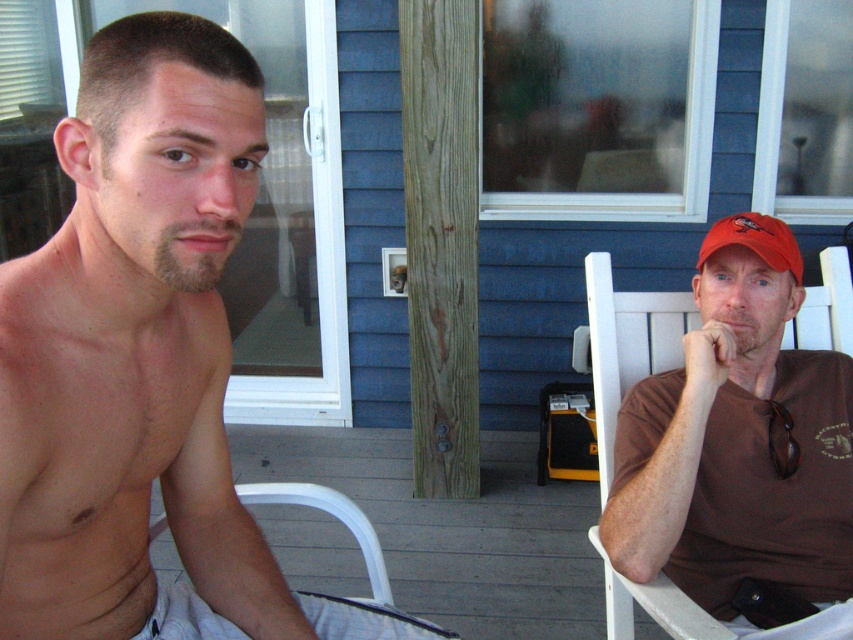
Can you confirm if shiny skin at left is positioned above brown matte shirt at right?

Correct, shiny skin at left is located above brown matte shirt at right.

Between shiny skin at left and brown matte shirt at right, which one has more height?

Standing taller between the two is shiny skin at left.

Which is in front, point (183, 38) or point (607, 504)?

Point (183, 38) is more forward.

Locate an element on the screen. shiny skin at left is located at coordinates (140, 368).

Is point (724, 422) closer to camera compared to point (215, 241)?

No.

Is brown matte shirt at right thinner than beige soft facial hair at center?

No, brown matte shirt at right is not thinner than beige soft facial hair at center.

What do you see at coordinates (738, 442) in the screenshot?
I see `brown matte shirt at right` at bounding box center [738, 442].

Locate an element on the screen. The height and width of the screenshot is (640, 853). brown matte shirt at right is located at coordinates (738, 442).

Can you confirm if brown matte shirt at right is wider than red matte baseball cap at right?

Correct, the width of brown matte shirt at right exceeds that of red matte baseball cap at right.

Which is in front, point (631, 460) or point (753, 237)?

Positioned in front is point (631, 460).

Locate an element on the screen. The width and height of the screenshot is (853, 640). brown matte shirt at right is located at coordinates (738, 442).